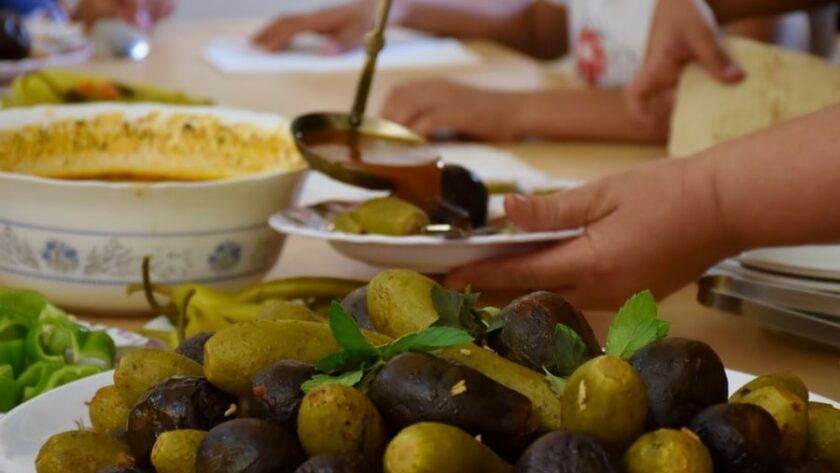
Locate an element on the screen. The image size is (840, 473). bowl is located at coordinates (444, 249).